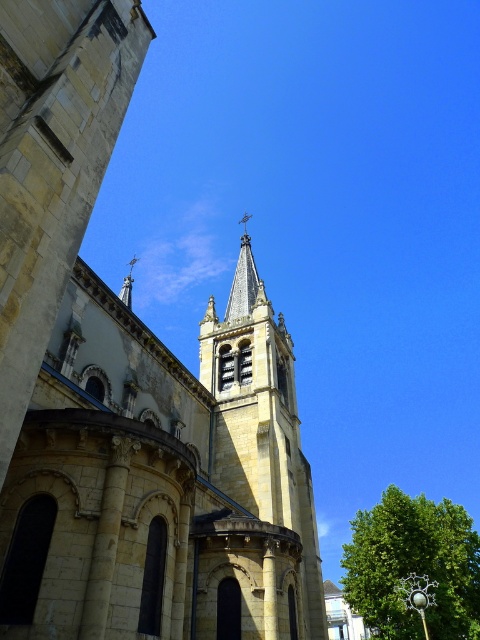
From the picture: You are standing in front of the historic church and notice the yellow stone church steeple at center and the green leafy tree at lower right. Which object appears smaller in the image?

The yellow stone church steeple at center appears smaller compared to the green leafy tree at lower right in the image.

You are standing in front of the historic church and notice two points marked on the bell tower. The first point is at coordinates point (135, 340) and the second is at point (309, 588). Which of these points is closer to your current position?

Point (135, 340) is closer to the camera than point (309, 588), so the first point is closer to your current position.

You are an architect assessing the space between the yellow stone church steeple at center and the green leafy tree at lower right. Based on their widths, which one do you think occupies more horizontal space in the image?

The green leafy tree at lower right occupies more horizontal space in the image because its width is greater than that of the yellow stone church steeple at center.